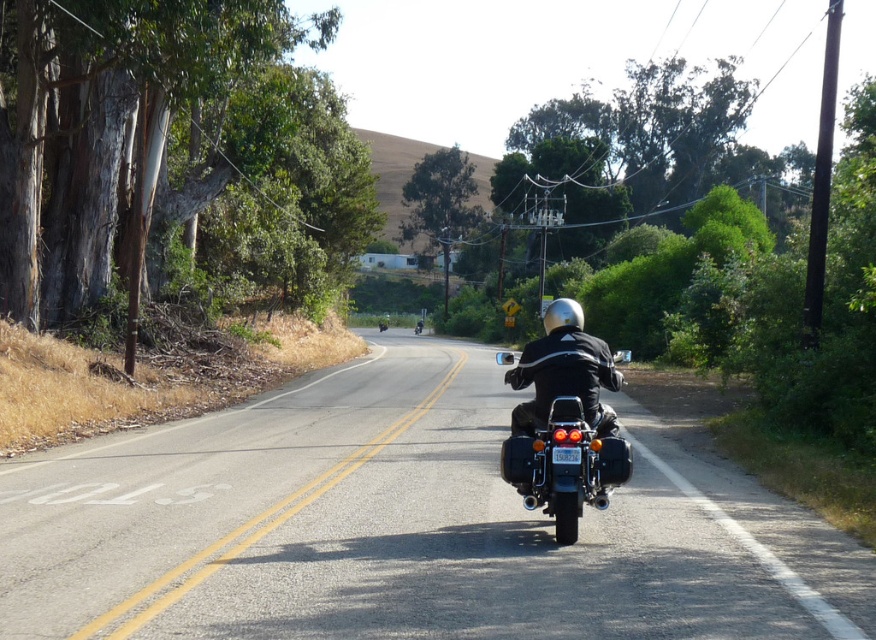
You are a driver approaching the black asphalt road at center and the black leather jacket at center from the distance. Which object will you encounter first?

The black asphalt road at center is in front of the black leather jacket at center, so you will encounter the black asphalt road at center first.

You are a cyclist approaching the black asphalt road at center and the black leather jacket at center. Which object is closer to the ground?

The black asphalt road at center is located below the black leather jacket at center, so it is closer to the ground.